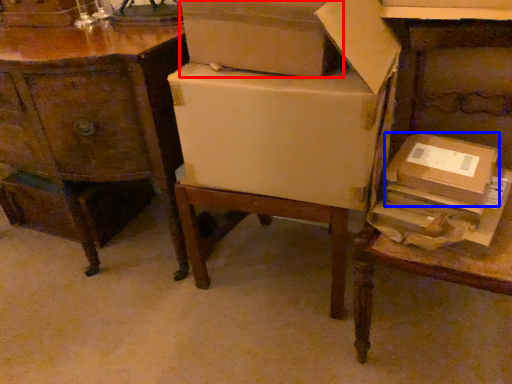
Question: Which object is further to the camera taking this photo, box (highlighted by a red box) or cardboard box (highlighted by a blue box)?

Choices:
 (A) box
 (B) cardboard box

Answer: (B)